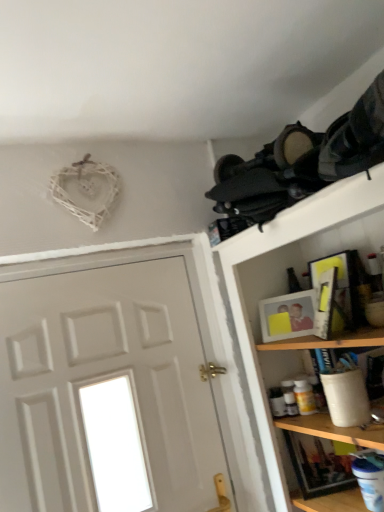
Question: Is matte white picture frame at upper right, the first picture frame from the back, behind matte yellow picture frame at upper right, the 2th picture frame when ordered from back to front?

Choices:
 (A) yes
 (B) no

Answer: (A)

Question: Does matte white picture frame at upper right, the first picture frame from the back, have a greater height compared to matte yellow picture frame at upper right, the 2th picture frame when ordered from back to front?

Choices:
 (A) yes
 (B) no

Answer: (B)

Question: Is matte white picture frame at upper right, the first picture frame from the back, at the right side of matte yellow picture frame at upper right, the 2th picture frame when ordered from back to front?

Choices:
 (A) no
 (B) yes

Answer: (A)

Question: Can you confirm if matte white picture frame at upper right, the first picture frame from the back, is smaller than matte yellow picture frame at upper right, which appears as the 1th picture frame when viewed from the front?

Choices:
 (A) no
 (B) yes

Answer: (B)

Question: From the image's perspective, does matte white picture frame at upper right, the first picture frame from the back, appear higher than matte yellow picture frame at upper right, which appears as the 1th picture frame when viewed from the front?

Choices:
 (A) no
 (B) yes

Answer: (A)

Question: Is matte white picture frame at upper right, the first picture frame from the back, directly adjacent to matte yellow picture frame at upper right, the 2th picture frame when ordered from back to front?

Choices:
 (A) yes
 (B) no

Answer: (B)

Question: Considering the relative positions of matte white picture frame at upper right, the second picture frame viewed from the front, and wooden shelf at upper right in the image provided, is matte white picture frame at upper right, the second picture frame viewed from the front, to the left of wooden shelf at upper right from the viewer's perspective?

Choices:
 (A) yes
 (B) no

Answer: (A)

Question: Considering the relative sizes of matte white picture frame at upper right, the first picture frame from the back, and wooden shelf at upper right in the image provided, is matte white picture frame at upper right, the first picture frame from the back, smaller than wooden shelf at upper right?

Choices:
 (A) yes
 (B) no

Answer: (A)

Question: Does matte white picture frame at upper right, the second picture frame viewed from the front, have a larger size compared to wooden shelf at upper right?

Choices:
 (A) no
 (B) yes

Answer: (A)

Question: Considering the relative sizes of matte white picture frame at upper right, the first picture frame from the back, and wooden shelf at upper right in the image provided, is matte white picture frame at upper right, the first picture frame from the back, wider than wooden shelf at upper right?

Choices:
 (A) yes
 (B) no

Answer: (B)

Question: Is matte white picture frame at upper right, the first picture frame from the back, facing towards wooden shelf at upper right?

Choices:
 (A) yes
 (B) no

Answer: (A)

Question: From the image's perspective, is matte white picture frame at upper right, the first picture frame from the back, located above wooden shelf at upper right?

Choices:
 (A) no
 (B) yes

Answer: (B)

Question: Is matte yellow picture frame at upper right, the 2th picture frame when ordered from back to front, facing away from wooden shelf at upper right?

Choices:
 (A) no
 (B) yes

Answer: (B)